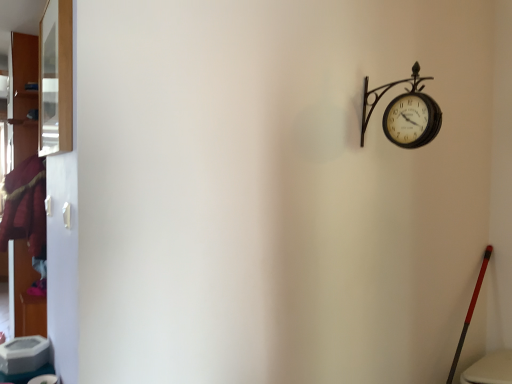
Question: Can you confirm if clear glass window at upper left is positioned to the left of velvet maroon coat at left?

Choices:
 (A) yes
 (B) no

Answer: (B)

Question: From the image's perspective, would you say clear glass window at upper left is shown under velvet maroon coat at left?

Choices:
 (A) no
 (B) yes

Answer: (A)

Question: Is clear glass window at upper left facing away from velvet maroon coat at left?

Choices:
 (A) yes
 (B) no

Answer: (B)

Question: From a real-world perspective, is clear glass window at upper left physically below velvet maroon coat at left?

Choices:
 (A) no
 (B) yes

Answer: (A)

Question: Can you confirm if clear glass window at upper left is shorter than velvet maroon coat at left?

Choices:
 (A) no
 (B) yes

Answer: (B)

Question: Considering the positions of metallic black clock at upper right and velvet maroon coat at left in the image, is metallic black clock at upper right wider or thinner than velvet maroon coat at left?

Choices:
 (A) thin
 (B) wide

Answer: (A)

Question: In terms of height, does metallic black clock at upper right look taller or shorter compared to velvet maroon coat at left?

Choices:
 (A) short
 (B) tall

Answer: (A)

Question: Relative to velvet maroon coat at left, is metallic black clock at upper right in front or behind?

Choices:
 (A) behind
 (B) front

Answer: (B)

Question: Is metallic black clock at upper right bigger or smaller than velvet maroon coat at left?

Choices:
 (A) small
 (B) big

Answer: (A)

Question: From a real-world perspective, relative to clear glass window at upper left, is metallic black clock at upper right vertically above or below?

Choices:
 (A) above
 (B) below

Answer: (B)

Question: Is metallic black clock at upper right inside the boundaries of clear glass window at upper left, or outside?

Choices:
 (A) outside
 (B) inside

Answer: (A)

Question: From the image's perspective, is metallic black clock at upper right located above or below clear glass window at upper left?

Choices:
 (A) below
 (B) above

Answer: (A)

Question: Based on their sizes in the image, would you say metallic black clock at upper right is bigger or smaller than clear glass window at upper left?

Choices:
 (A) big
 (B) small

Answer: (B)

Question: Would you say velvet maroon coat at left is to the left or to the right of metallic black clock at upper right in the picture?

Choices:
 (A) left
 (B) right

Answer: (A)

Question: From the image's perspective, relative to metallic black clock at upper right, is velvet maroon coat at left above or below?

Choices:
 (A) above
 (B) below

Answer: (B)